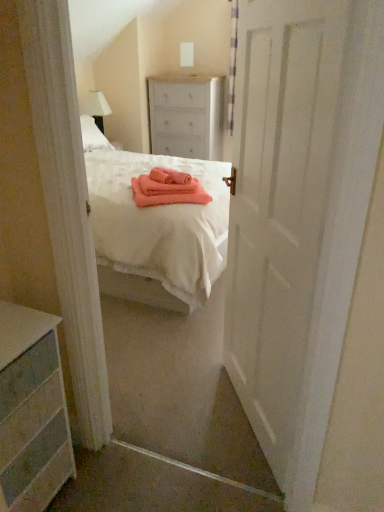
Question: Considering the positions of white painted wood chest of drawers at center, which appears as the second chest of drawers when viewed from the front, and pink fabric at center in the image, is white painted wood chest of drawers at center, which appears as the second chest of drawers when viewed from the front, taller or shorter than pink fabric at center?

Choices:
 (A) short
 (B) tall

Answer: (B)

Question: Considering the positions of white painted wood chest of drawers at center, arranged as the first chest of drawers when viewed from the right, and pink fabric at center in the image, is white painted wood chest of drawers at center, arranged as the first chest of drawers when viewed from the right, wider or thinner than pink fabric at center?

Choices:
 (A) thin
 (B) wide

Answer: (B)

Question: Which object is positioned closest to the white fabric lampshade at upper left?

Choices:
 (A) white painted wood dresser at lower left, placed as the second chest of drawers when sorted from back to front
 (B) pink fabric at center
 (C) white matte door at center
 (D) white painted wood chest of drawers at center, the second chest of drawers ordered from the bottom

Answer: (D)

Question: Estimate the real-world distances between objects in this image. Which object is farther from the white matte door at center?

Choices:
 (A) white fabric lampshade at upper left
 (B) white painted wood dresser at lower left, the second chest of drawers when ordered from top to bottom
 (C) white painted wood chest of drawers at center, arranged as the 1th chest of drawers when viewed from the back
 (D) pink fabric at center

Answer: (A)